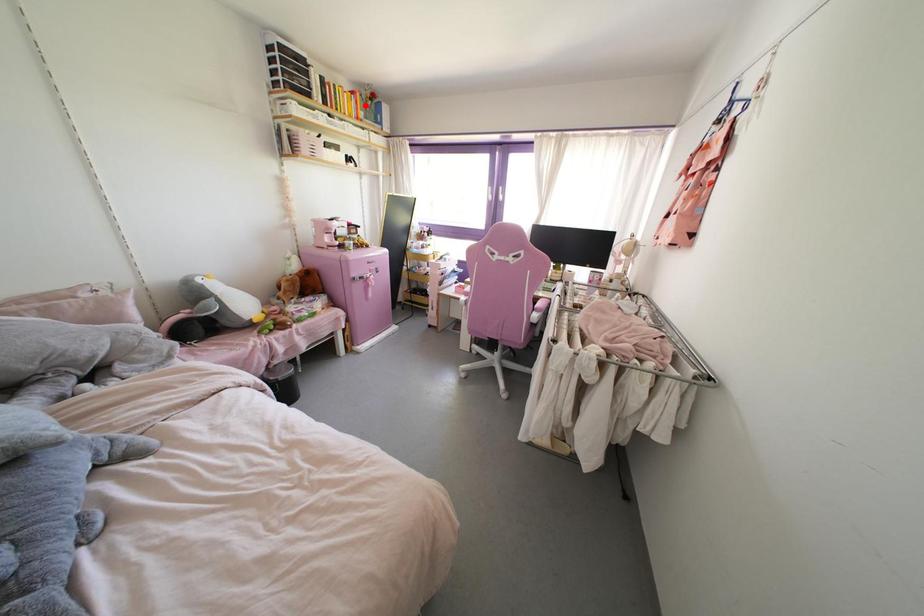
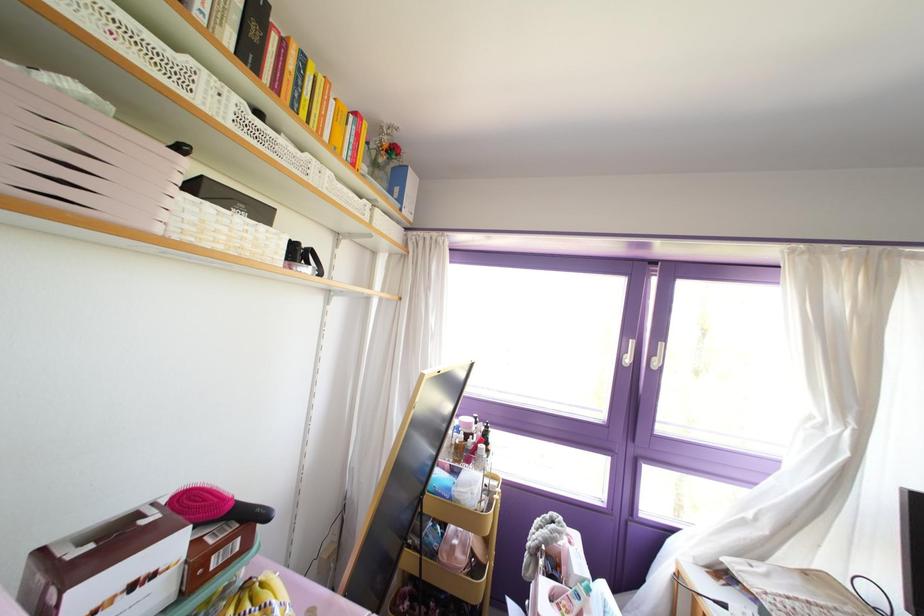
The point at the highlighted location is marked in the first image. Where is the corresponding point in the second image?

(372, 163)